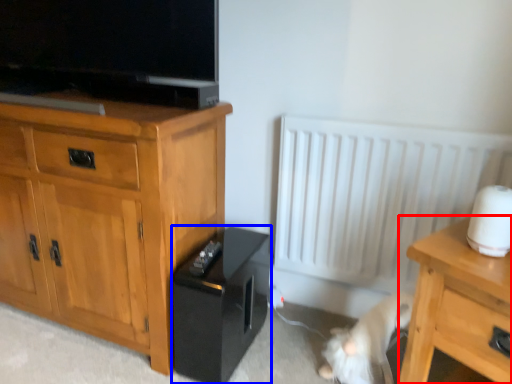
Question: Which object is closer to the camera taking this photo, nightstand (highlighted by a red box) or amplifier (highlighted by a blue box)?

Choices:
 (A) nightstand
 (B) amplifier

Answer: (A)